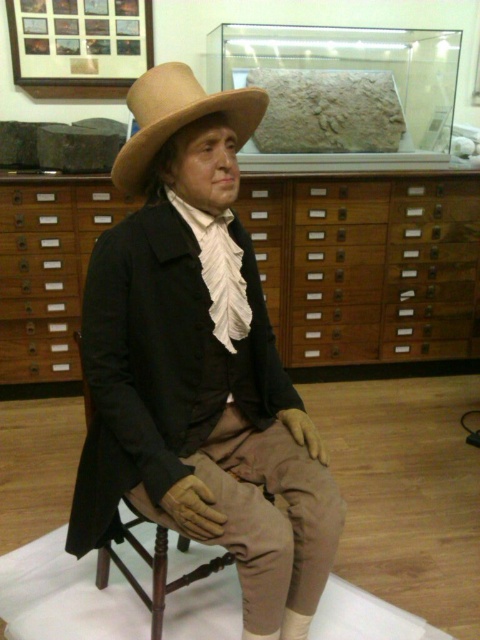
You are a visitor at the museum and want to take a photo of the wax figure. You notice two points in the image labeled as point 1 and point 2. If point 1 is at coordinate (x=430, y=272) and point 2 is at (x=196, y=81), which point is closer to the camera?

Point 1 at coordinate (x=430, y=272) is closer to the camera than point 2 at (x=196, y=81) because it is further to the camera.

You are a visitor in the museum and want to locate the point at coordinate (368, 266). Based on the scene description, where would this point be located?

The point at coordinate (368, 266) is located on the wooden drawers at center.

You are a visitor in the museum and want to take a photo of the light brown felt fedora at center without the wooden drawers at center appearing in the background. Is this possible?

The wooden drawers at center are closer to you than the light brown felt fedora at center. To take a photo of the fedora without the drawers in the background, you would need to position yourself so that the drawers are not behind the fedora. However, since the drawers are in front of the fedora, it might be challenging to avoid them unless you move to a side angle where the drawers are out of the frame.